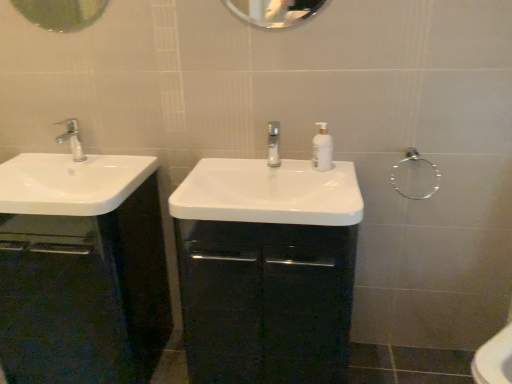
Question: In which direction should I rotate to look at clear glass mirror at upper center, the second mirror viewed from the left?

Choices:
 (A) left
 (B) right

Answer: (B)

Question: Considering the relative positions of silver metallic faucet at left, the second tap when ordered from right to left, and metallic circular mirror at upper left, which is the second mirror from right to left, in the image provided, is silver metallic faucet at left, the second tap when ordered from right to left, to the right of metallic circular mirror at upper left, which is the second mirror from right to left, from the viewer's perspective?

Choices:
 (A) yes
 (B) no

Answer: (B)

Question: Is silver metallic faucet at left, the 1th tap viewed from the left, taller than metallic circular mirror at upper left, which is counted as the 1th mirror, starting from the left?

Choices:
 (A) no
 (B) yes

Answer: (A)

Question: From the image's perspective, is silver metallic faucet at left, the 1th tap viewed from the left, below metallic circular mirror at upper left, which is counted as the 1th mirror, starting from the left?

Choices:
 (A) yes
 (B) no

Answer: (A)

Question: Is silver metallic faucet at left, the 1th tap viewed from the left, not within metallic circular mirror at upper left, which is counted as the 1th mirror, starting from the left?

Choices:
 (A) yes
 (B) no

Answer: (A)

Question: Is silver metallic faucet at left, the 1th tap viewed from the left, shorter than metallic circular mirror at upper left, which is counted as the 1th mirror, starting from the left?

Choices:
 (A) no
 (B) yes

Answer: (B)

Question: From a real-world perspective, is silver metallic faucet at left, the second tap when ordered from right to left, on top of metallic circular mirror at upper left, which is counted as the 1th mirror, starting from the left?

Choices:
 (A) yes
 (B) no

Answer: (B)

Question: Would you say white glossy sink at left, the second sink in the right-to-left sequence, is a long distance from clear glass mirror at upper center, the first mirror when ordered from right to left?

Choices:
 (A) no
 (B) yes

Answer: (A)

Question: Is white glossy sink at left, which is the first sink from left to right, next to clear glass mirror at upper center, the first mirror when ordered from right to left?

Choices:
 (A) no
 (B) yes

Answer: (A)

Question: Can you confirm if white glossy sink at left, which is the first sink from left to right, is wider than clear glass mirror at upper center, the first mirror when ordered from right to left?

Choices:
 (A) yes
 (B) no

Answer: (A)

Question: Is clear glass mirror at upper center, the second mirror viewed from the left, located within white glossy sink at left, the second sink in the right-to-left sequence?

Choices:
 (A) no
 (B) yes

Answer: (A)

Question: Can you confirm if white glossy sink at left, which is the first sink from left to right, is positioned to the right of clear glass mirror at upper center, the first mirror when ordered from right to left?

Choices:
 (A) yes
 (B) no

Answer: (B)

Question: Is white glossy sink at left, the second sink in the right-to-left sequence, oriented towards clear glass mirror at upper center, the first mirror when ordered from right to left?

Choices:
 (A) no
 (B) yes

Answer: (A)

Question: Can you confirm if clear glass tap at center, the 1th tap from the right, is smaller than white glossy sink at center, which is the 2th sink from left to right?

Choices:
 (A) yes
 (B) no

Answer: (A)